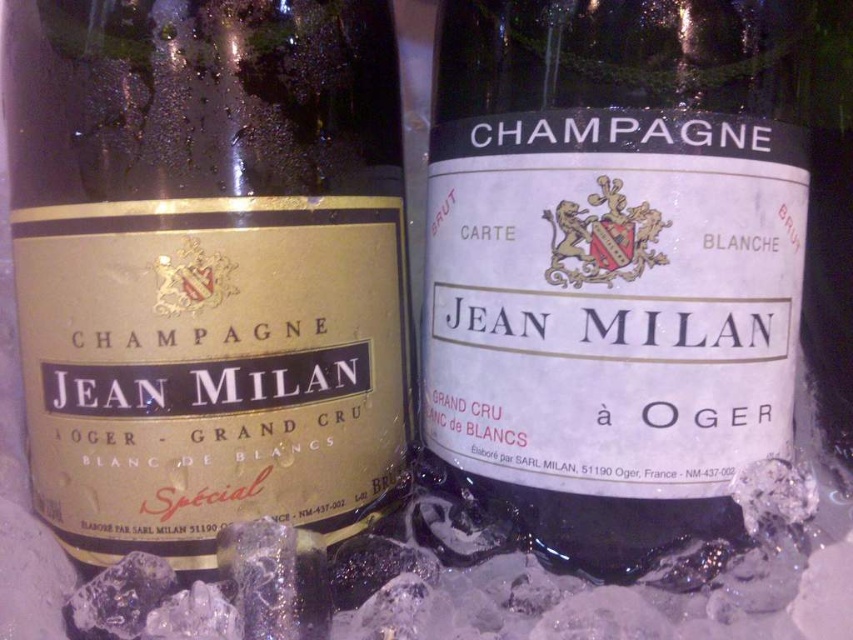
Can you confirm if gold matte champagne bottle at center is taller than white matte champagne bottle at center?

In fact, gold matte champagne bottle at center may be shorter than white matte champagne bottle at center.

What are the coordinates of `gold matte champagne bottle at center` in the screenshot? It's located at (207, 266).

Where is `gold matte champagne bottle at center`? gold matte champagne bottle at center is located at coordinates click(207, 266).